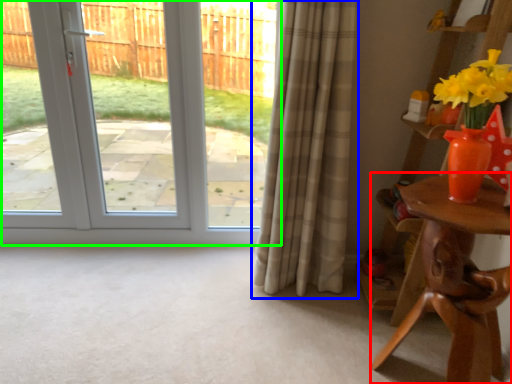
Question: Which object is the farthest from table (highlighted by a red box)? Choose among these: curtain (highlighted by a blue box) or door (highlighted by a green box).

Choices:
 (A) curtain
 (B) door

Answer: (B)